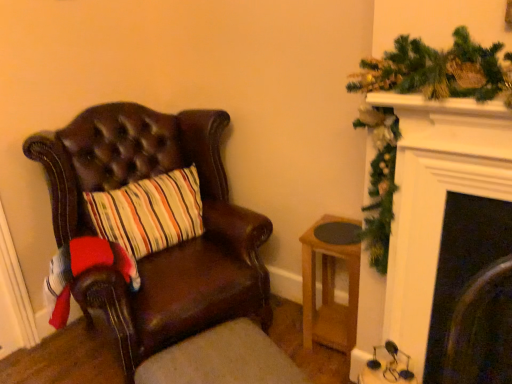
You are a GUI agent. You are given a task and a screenshot of the screen. Output one action in this format:
    pyautogui.click(x=<x>, y=<y>)
    Task: Click on the brown leather footrest at lower left
    This screenshot has height=384, width=512.
    Given the screenshot: What is the action you would take?
    pyautogui.click(x=222, y=359)

Are brown leather footrest at lower left and leather chair at left located far from each other?

They are positioned close to each other.

Is brown leather footrest at lower left facing away from leather chair at left?

Yes, brown leather footrest at lower left is positioned with its back facing leather chair at left.

Which is behind, point (155, 374) or point (163, 324)?

The point (163, 324) is farther from the camera.

Which object is positioned more to the right, brown leather footrest at lower left or leather chair at left?

From the viewer's perspective, brown leather footrest at lower left appears more on the right side.

In order to click on footrest below the leather chair at left (from the image's perspective) in this screenshot , I will do click(222, 359).

Is brown leather footrest at lower left completely or partially inside leather chair at left?

No, brown leather footrest at lower left is not inside leather chair at left.

Would you consider leather chair at left to be distant from brown leather footrest at lower left?

That's not correct — leather chair at left is a little close to brown leather footrest at lower left.

Is leather chair at left wider or thinner than brown leather footrest at lower left?

Clearly, leather chair at left has more width compared to brown leather footrest at lower left.

Is point (259, 354) closer to viewer compared to point (347, 310)?

Yes, point (259, 354) is closer to viewer.

Can you confirm if brown leather footrest at lower left is wider than light brown wooden stool at lower right?

Yes.

Considering the relative positions of brown leather footrest at lower left and light brown wooden stool at lower right in the image provided, is brown leather footrest at lower left behind light brown wooden stool at lower right?

No, brown leather footrest at lower left is closer to the viewer.

Image resolution: width=512 pixels, height=384 pixels. Find the location of `chair located above the light brown wooden stool at lower right (from a real-world perspective)`. chair located above the light brown wooden stool at lower right (from a real-world perspective) is located at coordinates (165, 250).

From the image's perspective, does light brown wooden stool at lower right appear lower than leather chair at left?

Correct, light brown wooden stool at lower right appears lower than leather chair at left in the image.

Considering the relative sizes of light brown wooden stool at lower right and leather chair at left in the image provided, is light brown wooden stool at lower right wider than leather chair at left?

No, light brown wooden stool at lower right is not wider than leather chair at left.

Locate an element on the screen. Image resolution: width=512 pixels, height=384 pixels. the footrest that appears below the light brown wooden stool at lower right (from the image's perspective) is located at coordinates (222, 359).

Is light brown wooden stool at lower right taller than brown leather footrest at lower left?

Yes, light brown wooden stool at lower right is taller than brown leather footrest at lower left.

Can you see light brown wooden stool at lower right touching brown leather footrest at lower left?

No, light brown wooden stool at lower right is not with brown leather footrest at lower left.

Is leather chair at left not near light brown wooden stool at lower right?

That's not correct — leather chair at left is a little close to light brown wooden stool at lower right.

From the image's perspective, is leather chair at left positioned above or below light brown wooden stool at lower right?

From the image's perspective, leather chair at left appears above light brown wooden stool at lower right.

In terms of height, does leather chair at left look taller or shorter compared to light brown wooden stool at lower right?

leather chair at left is taller than light brown wooden stool at lower right.

You are a GUI agent. You are given a task and a screenshot of the screen. Output one action in this format:
    pyautogui.click(x=<x>, y=<y>)
    Task: Click on the footrest lying in front of the leather chair at left
    This screenshot has width=512, height=384.
    Given the screenshot: What is the action you would take?
    pyautogui.click(x=222, y=359)

Image resolution: width=512 pixels, height=384 pixels. In order to click on the footrest below the leather chair at left (from the image's perspective) in this screenshot , I will do `click(222, 359)`.

Considering their positions, is light brown wooden stool at lower right positioned closer to brown leather footrest at lower left than leather chair at left?

leather chair at left lies closer to brown leather footrest at lower left than the other object.

When comparing their distances from leather chair at left, does light brown wooden stool at lower right or brown leather footrest at lower left seem further?

light brown wooden stool at lower right lies further to leather chair at left than the other object.

From the image, which object appears to be nearer to leather chair at left, brown leather footrest at lower left or light brown wooden stool at lower right?

brown leather footrest at lower left.

Considering their positions, is leather chair at left positioned closer to brown leather footrest at lower left than light brown wooden stool at lower right?

The object closer to brown leather footrest at lower left is leather chair at left.

Which object lies further to the anchor point light brown wooden stool at lower right, leather chair at left or brown leather footrest at lower left?

leather chair at left.

Estimate the real-world distances between objects in this image. Which object is closer to light brown wooden stool at lower right, brown leather footrest at lower left or leather chair at left?

Among the two, brown leather footrest at lower left is located nearer to light brown wooden stool at lower right.

I want to click on the footrest located between leather chair at left and light brown wooden stool at lower right in the left-right direction, so click(x=222, y=359).